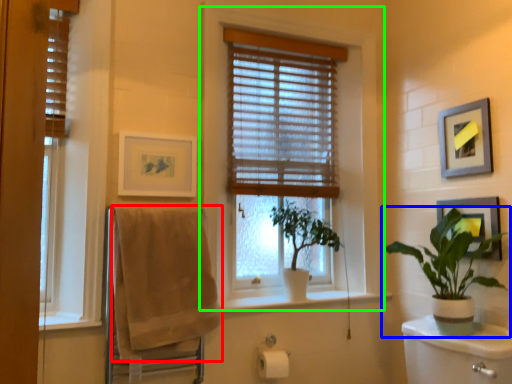
Question: Which object is the farthest from bath towel (highlighted by a red box)? Choose among these: houseplant (highlighted by a blue box) or window (highlighted by a green box).

Choices:
 (A) houseplant
 (B) window

Answer: (A)